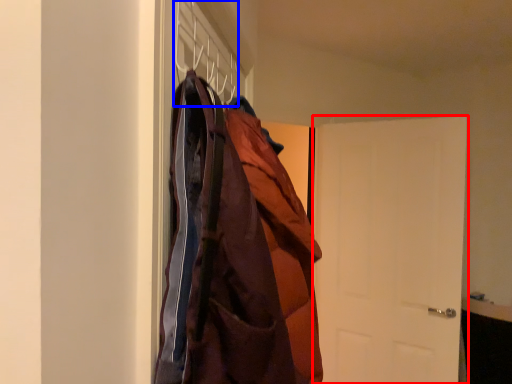
Question: Which object appears closest to the camera in this image, door (highlighted by a red box) or hanger (highlighted by a blue box)?

Choices:
 (A) door
 (B) hanger

Answer: (B)